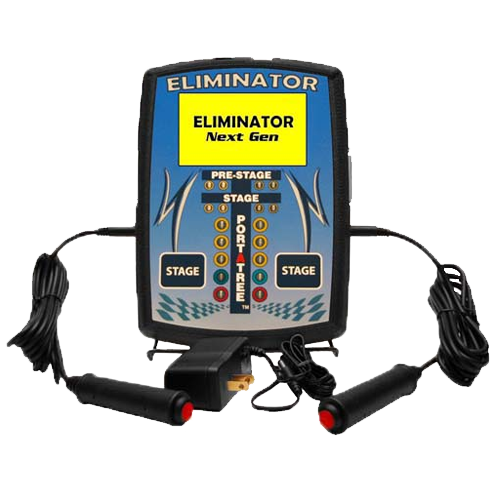
Where is `indicator lights`? indicator lights is located at coordinates (262, 290), (262, 274), (259, 258), (260, 242), (258, 223), (224, 221), (227, 243), (226, 260), (221, 298), (227, 275).